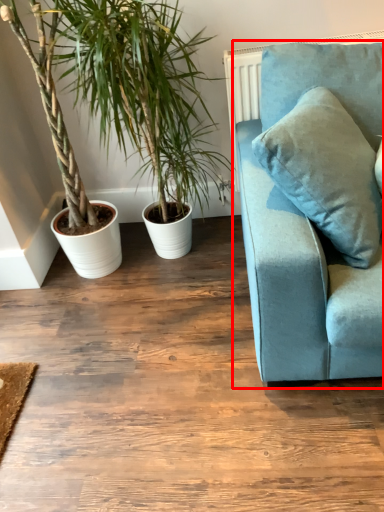
Question: From the image's perspective, what is the correct spatial positioning of studio couch (annotated by the red box) in reference to houseplant?

Choices:
 (A) above
 (B) below

Answer: (B)